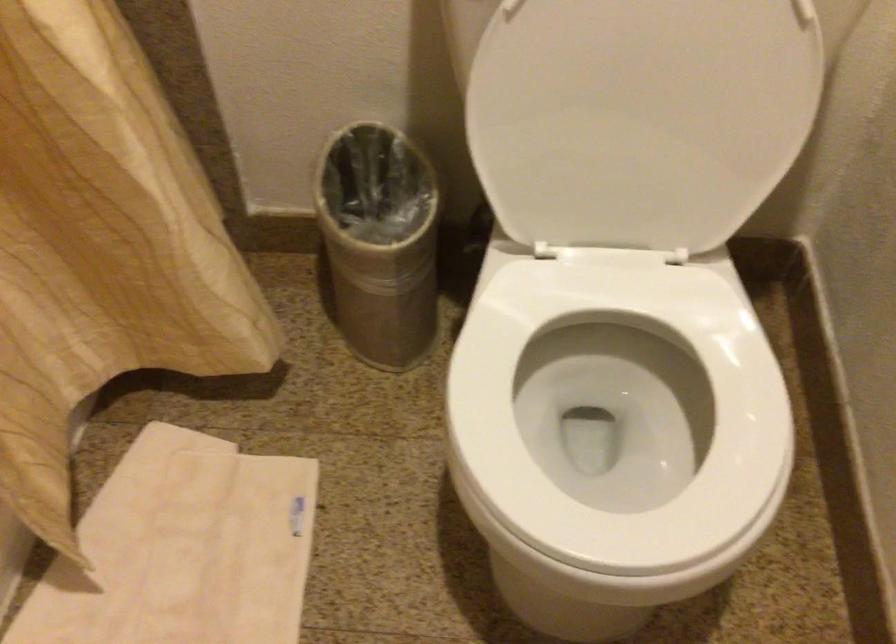
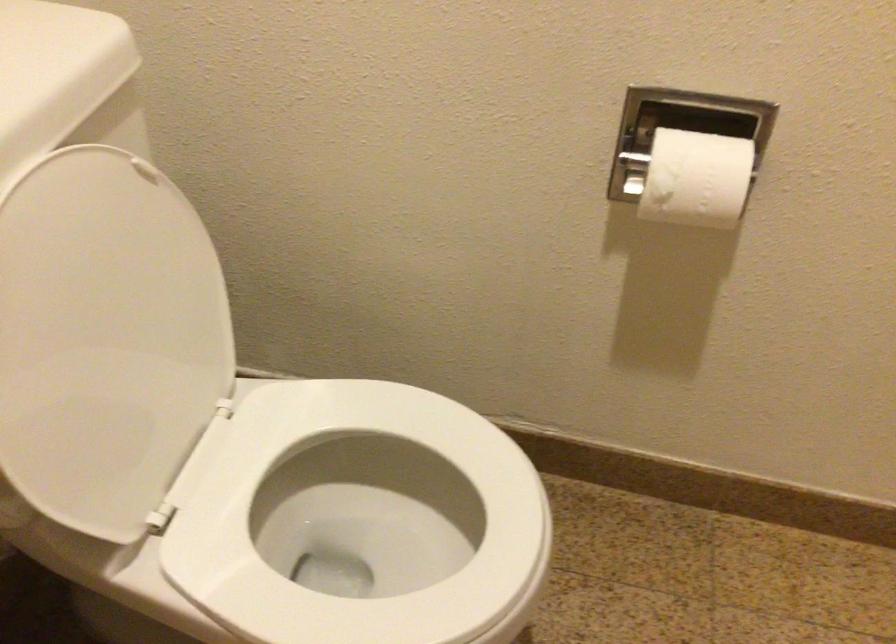
Where in the second image is the point corresponding to point (621, 91) from the first image?

(105, 339)